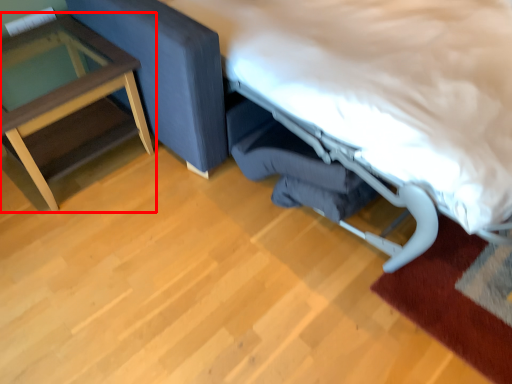
Question: From the image's perspective, where is table (annotated by the red box) located in relation to bed in the image?

Choices:
 (A) above
 (B) below

Answer: (B)